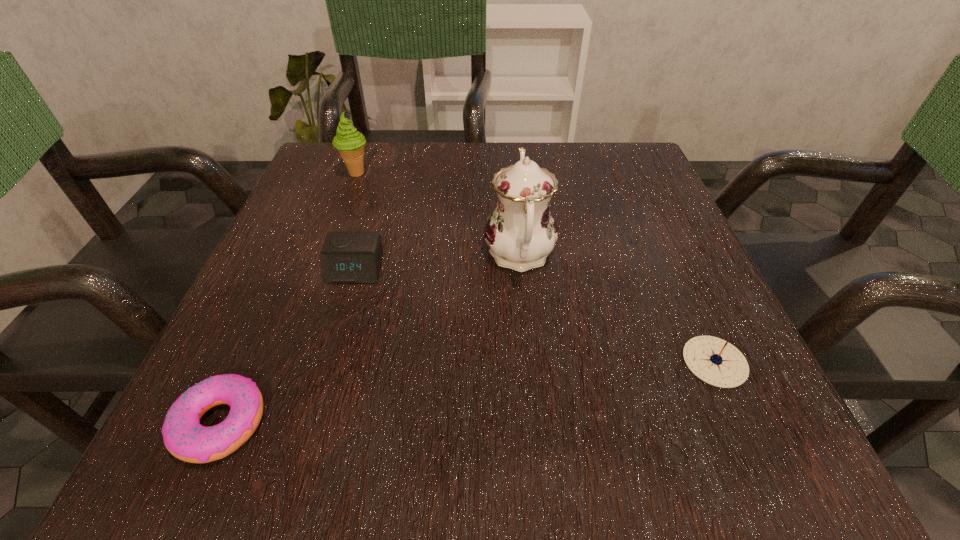
Identify the location of chinaware. This screenshot has height=540, width=960. (521, 231).

In order to click on the tallest object in this screenshot , I will do `click(521, 231)`.

The width and height of the screenshot is (960, 540). In order to click on the farthest object in this screenshot , I will do `click(350, 143)`.

Locate an element on the screen. the fourth shortest object is located at coordinates (350, 143).

Locate an element on the screen. The image size is (960, 540). alarm clock is located at coordinates (347, 257).

You are a GUI agent. You are given a task and a screenshot of the screen. Output one action in this format:
    pyautogui.click(x=<x>, y=<y>)
    Task: Click on the rightmost object
    
    Given the screenshot: What is the action you would take?
    pyautogui.click(x=715, y=361)

At what (x,y) coordinates should I click in order to perform the action: click on the shortest object. Please return your answer as a coordinate pair (x, y). Image resolution: width=960 pixels, height=540 pixels. Looking at the image, I should click on (185, 438).

Identify the location of vacant space located 0.350m on the left of the tallest object. The height and width of the screenshot is (540, 960). (284, 255).

The image size is (960, 540). What are the coordinates of `vacant area located 0.220m on the front of the fourth shortest object` in the screenshot? It's located at (328, 251).

You are a GUI agent. You are given a task and a screenshot of the screen. Output one action in this format:
    pyautogui.click(x=<x>, y=<y>)
    Task: Click on the free spot located on the front-facing side of the alarm clock
    This screenshot has width=960, height=540.
    Given the screenshot: What is the action you would take?
    pyautogui.click(x=307, y=437)